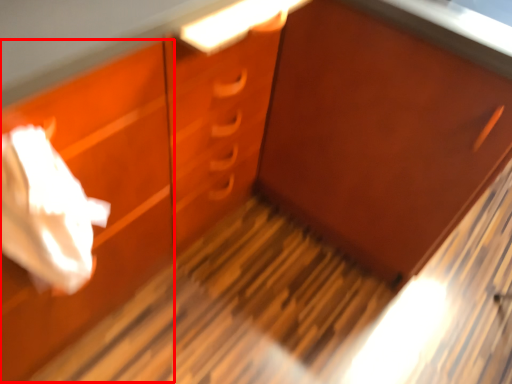
Question: From the image's perspective, what is the correct spatial relationship of drawer (annotated by the red box) in relation to cabinetry?

Choices:
 (A) below
 (B) above

Answer: (A)